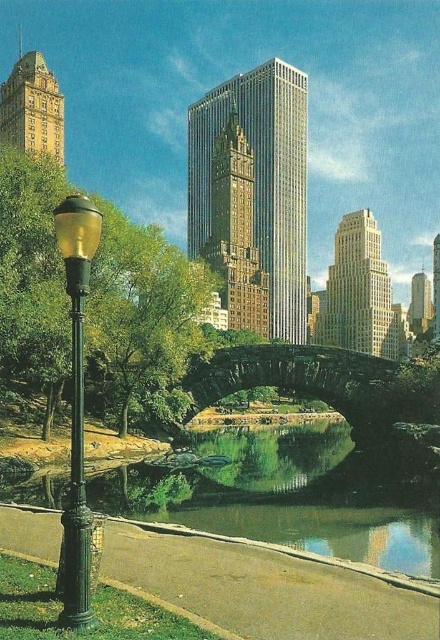
Based on the photo, between green polished metal street light at left and shiny silver skyscraper at right, which one is positioned higher?

shiny silver skyscraper at right is higher up.

Is green polished metal street light at left positioned in front of shiny silver skyscraper at right?

Yes, green polished metal street light at left is in front of shiny silver skyscraper at right.

This screenshot has height=640, width=440. In order to click on green polished metal street light at left in this screenshot , I will do `click(77, 404)`.

Where is `green polished metal street light at left`? green polished metal street light at left is located at coordinates (77, 404).

From the picture: Is gold textured building at center thinner than green polished metal street light at left?

Incorrect, gold textured building at center's width is not less than green polished metal street light at left's.

Is the position of gold textured building at center less distant than that of green polished metal street light at left?

No, it is behind green polished metal street light at left.

You are a GUI agent. You are given a task and a screenshot of the screen. Output one action in this format:
    pyautogui.click(x=<x>, y=<y>)
    Task: Click on the gold textured building at center
    
    Given the screenshot: What is the action you would take?
    pyautogui.click(x=260, y=179)

Where is `gold textured building at center`? gold textured building at center is located at coordinates (260, 179).

Between stone textured bridge at center and beige stone skyscraper at center, which one has more height?

With more height is beige stone skyscraper at center.

Does stone textured bridge at center have a greater width compared to beige stone skyscraper at center?

Yes.

You are a GUI agent. You are given a task and a screenshot of the screen. Output one action in this format:
    pyautogui.click(x=<x>, y=<y>)
    Task: Click on the stone textured bridge at center
    The image size is (440, 640).
    Given the screenshot: What is the action you would take?
    pyautogui.click(x=323, y=381)

You are a GUI agent. You are given a task and a screenshot of the screen. Output one action in this format:
    pyautogui.click(x=<x>, y=<y>)
    Task: Click on the stone textured bridge at center
    
    Given the screenshot: What is the action you would take?
    pyautogui.click(x=323, y=381)